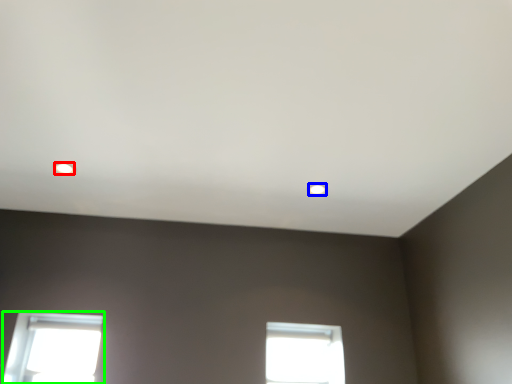
Question: Which object is the farthest from lighting (highlighted by a red box)? Choose among these: lighting (highlighted by a blue box) or window (highlighted by a green box).

Choices:
 (A) lighting
 (B) window

Answer: (A)